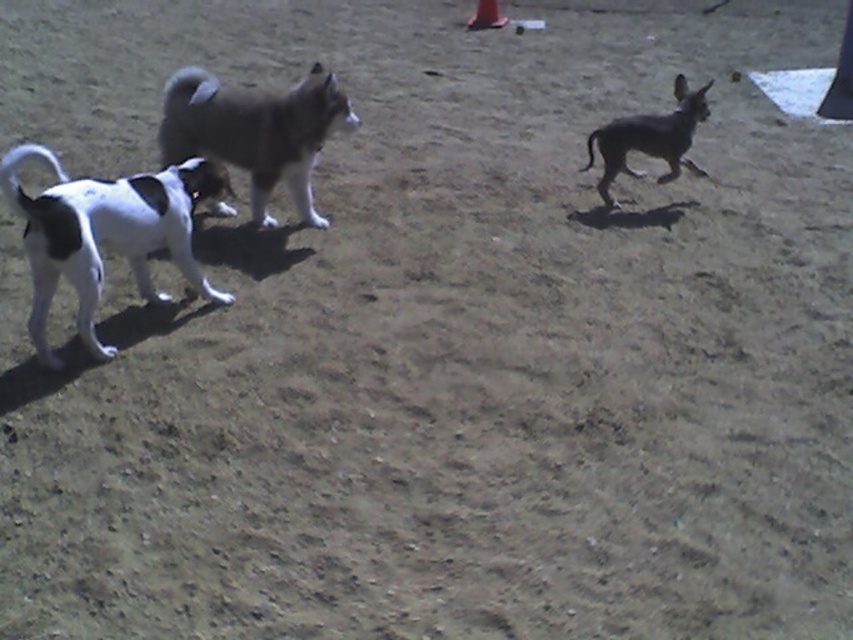
Based on the photo, is white and black fur dog at left below orange matte cone at upper right?

Correct, white and black fur dog at left is located below orange matte cone at upper right.

Is white and black fur dog at left taller than orange matte cone at upper right?

Yes, white and black fur dog at left is taller than orange matte cone at upper right.

At what (x,y) coordinates should I click in order to perform the action: click on white and black fur dog at left. Please return your answer as a coordinate pair (x, y). Looking at the image, I should click on (106, 234).

Find the location of a particular element. The width and height of the screenshot is (853, 640). white and black fur dog at left is located at coordinates (106, 234).

Does point (231, 118) come farther from viewer compared to point (498, 13)?

No, it is not.

Does gray fur dog at center appear on the left side of orange plastic cone at center?

Yes, gray fur dog at center is to the left of orange plastic cone at center.

Is point (323, 96) more distant than point (491, 1)?

No, it is in front of (491, 1).

Where is `gray fur dog at center`? This screenshot has width=853, height=640. gray fur dog at center is located at coordinates (254, 131).

Is white and black fur dog at left below orange plastic cone at center?

Correct, white and black fur dog at left is located below orange plastic cone at center.

Is white and black fur dog at left closer to camera compared to orange plastic cone at center?

Yes, white and black fur dog at left is in front of orange plastic cone at center.

Does point (48, 260) come behind point (482, 22)?

No, (48, 260) is closer to viewer.

In order to click on white and black fur dog at left in this screenshot , I will do `click(106, 234)`.